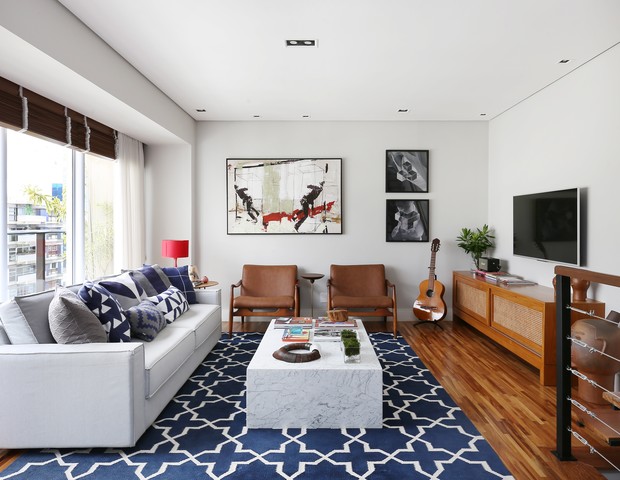
The width and height of the screenshot is (620, 480). What are the coordinates of `floor` in the screenshot? It's located at (476, 414).